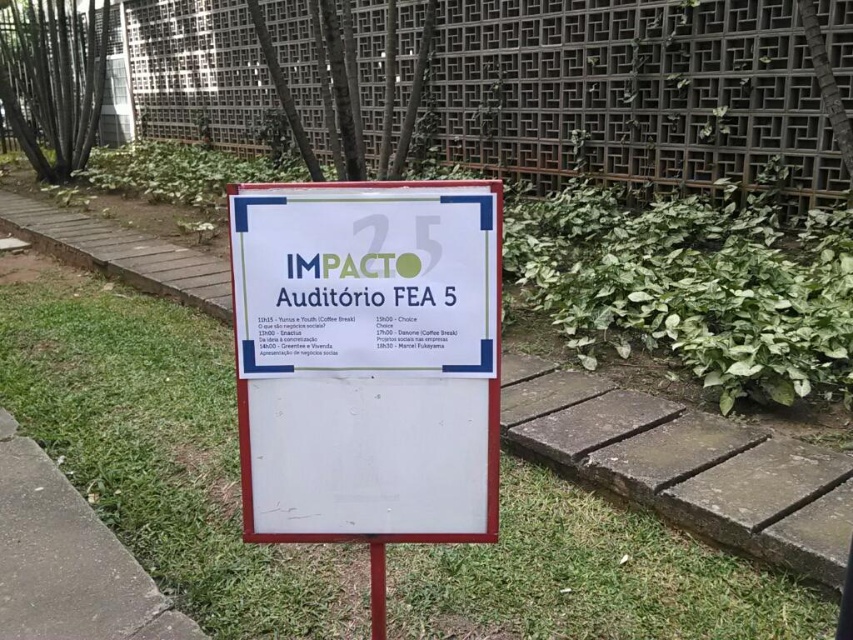
You are standing in the outdoor area and want to walk towards the signboard. Which object will you pass first, the green grass at center or the metallic grid fence at upper center?

The green grass at center is in front of the metallic grid fence at upper center, so you will pass the green grass at center first before reaching the metallic grid fence at upper center.

Looking at this image, you are standing in front of the signboard at the outdoor event. You notice two points marked on the signboard. One is at coordinate point (x=79, y=563) and the other is at point (x=379, y=596). Which point is closer to you?

Point (x=79, y=563) is further to the camera than point (x=379, y=596), so the point closer to you is point (x=379, y=596).

You are standing in the outdoor area shown in the image. You need to place a small picnic blanket that requires a flat area larger than the metallic red post at center. Is there enough space on the green grass at lower left for the picnic blanket?

The green grass at lower left is larger in size than the metallic red post at center, so yes, there is enough space on the green grass at lower left for the picnic blanket since it is bigger than the post.